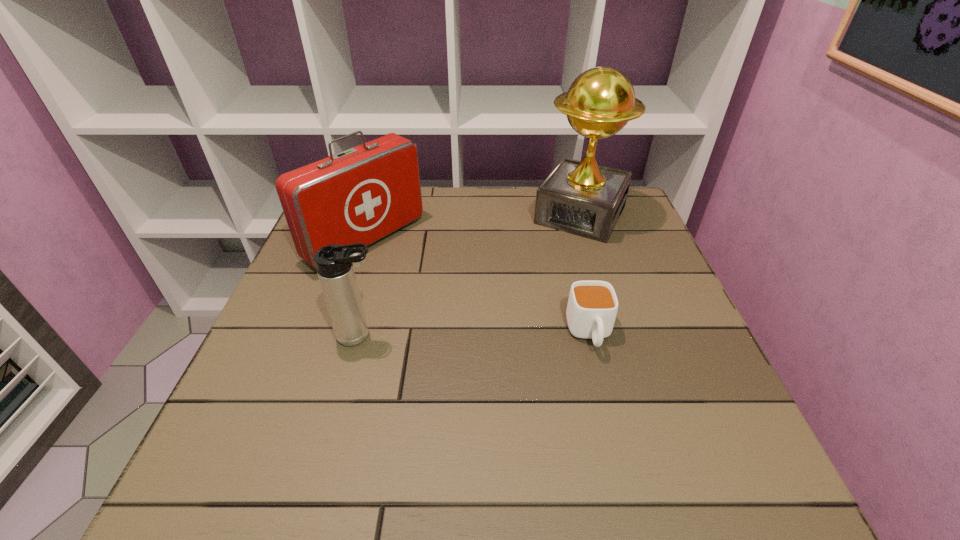
The height and width of the screenshot is (540, 960). Find the location of `free location at the near edge of the desktop`. free location at the near edge of the desktop is located at coordinates (334, 409).

Image resolution: width=960 pixels, height=540 pixels. In order to click on vacant space at the left edge in this screenshot , I will do `click(266, 383)`.

The width and height of the screenshot is (960, 540). Find the location of `free space at the right edge of the desktop`. free space at the right edge of the desktop is located at coordinates (684, 328).

Where is `vacant space at the near left corner of the desktop`? The height and width of the screenshot is (540, 960). vacant space at the near left corner of the desktop is located at coordinates (248, 407).

Locate an element on the screen. This screenshot has width=960, height=540. free space at the far right corner is located at coordinates (617, 233).

The height and width of the screenshot is (540, 960). In the image, there is a desktop. In order to click on vacant space at the near right corner in this screenshot , I will do `click(723, 407)`.

At what (x,y) coordinates should I click in order to perform the action: click on free space between the third tallest object and the tallest object. Please return your answer as a coordinate pair (x, y). This screenshot has height=540, width=960. Looking at the image, I should click on (470, 275).

Locate an element on the screen. The width and height of the screenshot is (960, 540). unoccupied area between the tallest object and the third shortest object is located at coordinates (473, 227).

Image resolution: width=960 pixels, height=540 pixels. I want to click on free space that is in between the award and the first-aid kit, so click(x=473, y=227).

You are a GUI agent. You are given a task and a screenshot of the screen. Output one action in this format:
    pyautogui.click(x=<x>, y=<y>)
    Task: Click on the empty space between the thermos bottle and the award
    The image size is (960, 540).
    Given the screenshot: What is the action you would take?
    pyautogui.click(x=470, y=275)